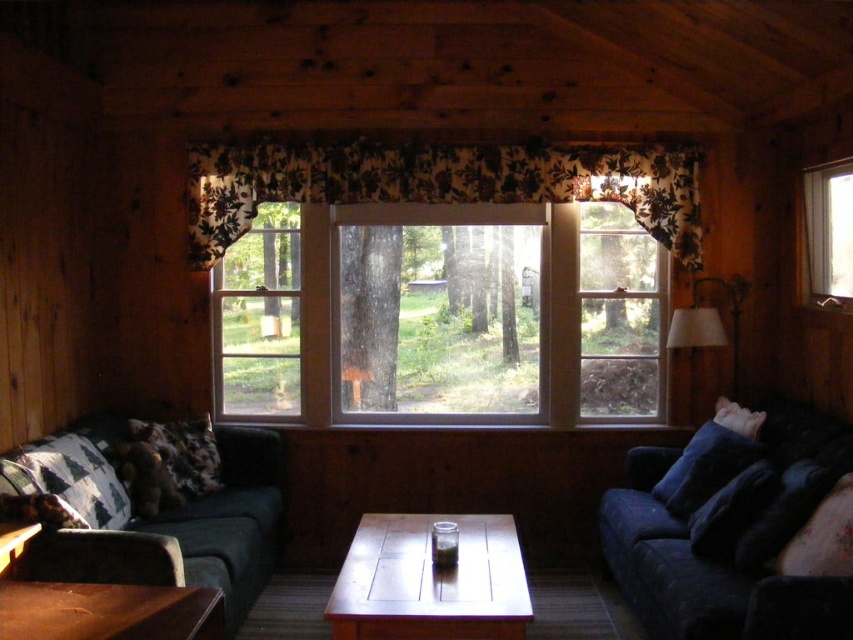
You are sitting on a couch in the living room and want to look outside through the transparent glass window at upper right. To do this, should you turn your head to your right or left from facing the fluffy dark brown pillow at lower right?

The transparent glass window at upper right is positioned on the right side of the fluffy dark brown pillow at lower right, so you should turn your head to your right to look outside through the transparent glass window at upper right.

You are arranging a large painting that is 1.5 meters wide. You want to place it either on the wooden table at center or hang it on the clear glass window at center. Based on their sizes, which location would be suitable for the painting?

The clear glass window at center has a larger width than the wooden table at center. Therefore, the painting would fit better on the clear glass window at center since its width is sufficient to accommodate the 1.5 meter wide painting.

You are an interior designer planning to hang a large painting that requires a tall space. You have two options in the living room scene provided. Which object, the transparent glass window at upper right or the fluffy floral pillow at lower right, would you choose to place the painting above?

The transparent glass window at upper right is much taller than the fluffy floral pillow at lower right, so you should choose to place the painting above the transparent glass window at upper right because it provides a taller space for the painting.